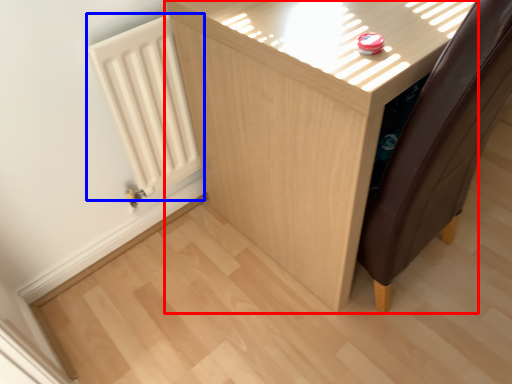
Question: Which point is further to the camera, furniture (highlighted by a red box) or radiator (highlighted by a blue box)?

Choices:
 (A) furniture
 (B) radiator

Answer: (B)